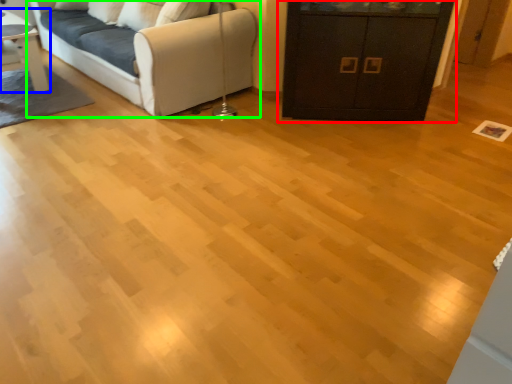
Question: Which object is the closest to the cabinetry (highlighted by a red box)? Choose among these: table (highlighted by a blue box) or studio couch (highlighted by a green box).

Choices:
 (A) table
 (B) studio couch

Answer: (B)